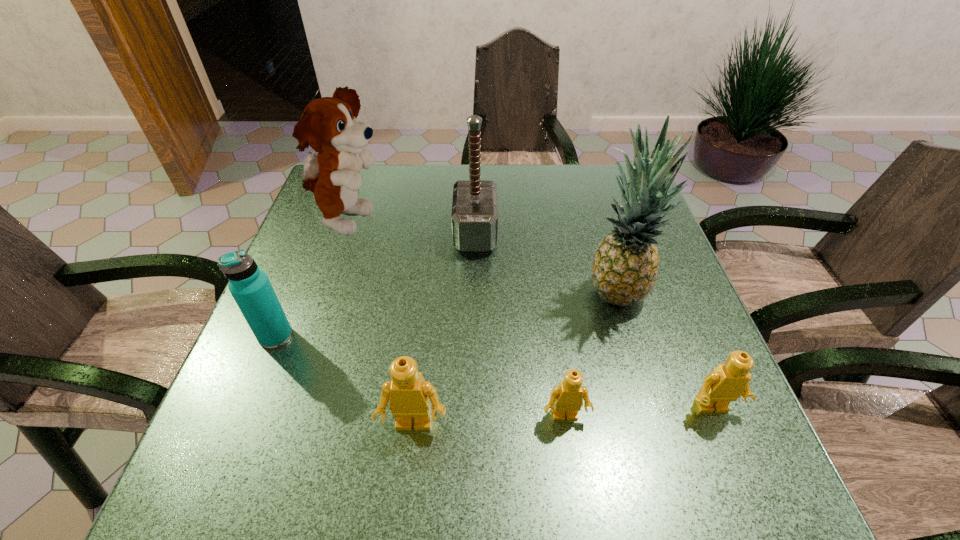
The image size is (960, 540). I want to click on empty space between the sixth tallest object and the fourth farthest object, so click(x=494, y=372).

Image resolution: width=960 pixels, height=540 pixels. I want to click on vacant point located between the second Lego from left to right and the leftmost Lego, so click(x=490, y=421).

This screenshot has width=960, height=540. In order to click on free space that is in between the hammer and the second Lego from left to right in this screenshot , I will do `click(520, 325)`.

The image size is (960, 540). In order to click on empty space between the fifth object from left to right and the hammer in this screenshot , I will do `click(520, 325)`.

At what (x,y) coordinates should I click in order to perform the action: click on free space between the water bottle and the pineapple. Please return your answer as a coordinate pair (x, y). Looking at the image, I should click on (445, 314).

Identify which object is the second nearest to the third object from right to left. Please provide its 2D coordinates. Your answer should be formatted as a tuple, i.e. [(x, y)], where the tuple contains the x and y coordinates of a point satisfying the conditions above.

[(727, 382)]

Find the location of `object that is the sixth closest to the second shortest object`. object that is the sixth closest to the second shortest object is located at coordinates (250, 286).

At what (x,y) coordinates should I click in order to perform the action: click on Lego that can be found as the second closest to the fifth nearest object. Please return your answer as a coordinate pair (x, y). Image resolution: width=960 pixels, height=540 pixels. Looking at the image, I should click on (567, 397).

Find the location of a particular element. The width and height of the screenshot is (960, 540). Lego identified as the closest to the puppy is located at coordinates (409, 395).

Find the location of a particular element. free space that satisfies the following two spatial constraints: 1. on the face of the pineapple; 2. on the left side of the puppy is located at coordinates (325, 291).